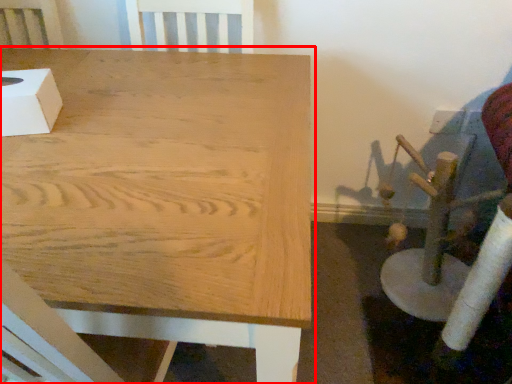
Question: From the image, what is the correct spatial relationship of table (annotated by the red box) in relation to box?

Choices:
 (A) left
 (B) right

Answer: (B)